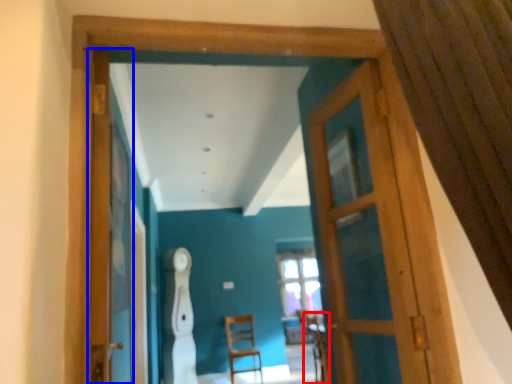
Question: Which object is further to the camera taking this photo, armchair (highlighted by a red box) or screen door (highlighted by a blue box)?

Choices:
 (A) armchair
 (B) screen door

Answer: (A)